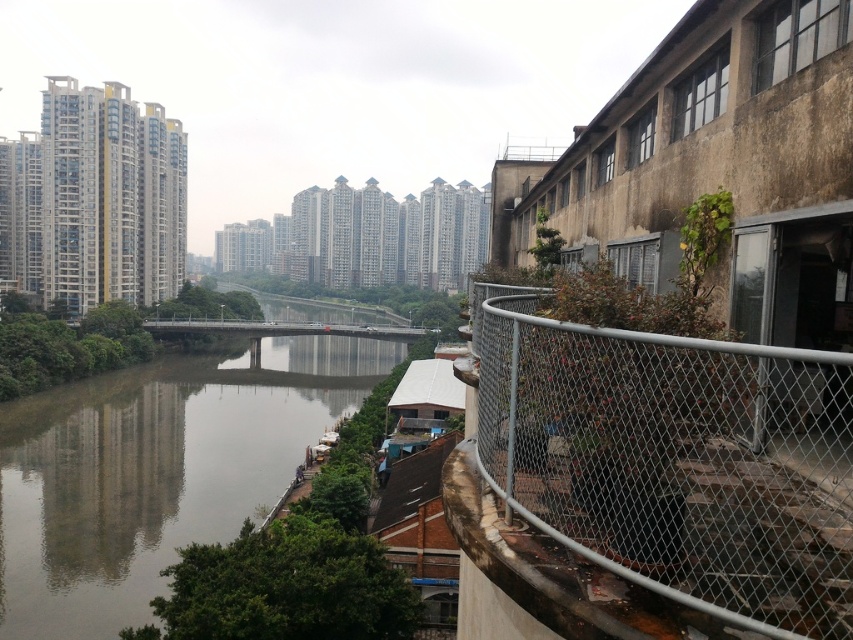
Question: Which object appears farthest from the camera in this image?

Choices:
 (A) brown concrete river at center
 (B) silver chain-link fence at right

Answer: (A)

Question: Can you confirm if silver chain-link fence at right is thinner than brown concrete river at center?

Choices:
 (A) no
 (B) yes

Answer: (B)

Question: Among these objects, which one is farthest from the camera?

Choices:
 (A) brown concrete river at center
 (B) silver chain-link fence at right

Answer: (A)

Question: Can you confirm if silver chain-link fence at right is positioned above brown concrete river at center?

Choices:
 (A) no
 (B) yes

Answer: (B)

Question: Does silver chain-link fence at right have a larger size compared to brown concrete river at center?

Choices:
 (A) yes
 (B) no

Answer: (B)